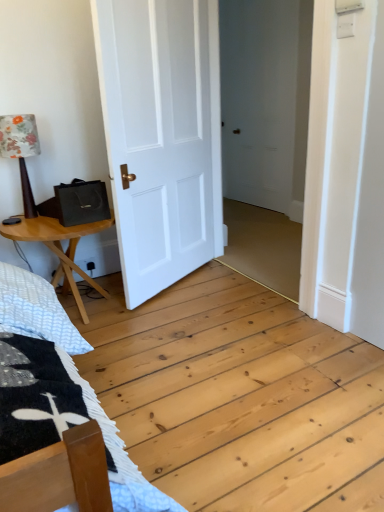
The image size is (384, 512). In order to click on free spot above wooden table at left (from a real-world perspective) in this screenshot , I will do `click(47, 222)`.